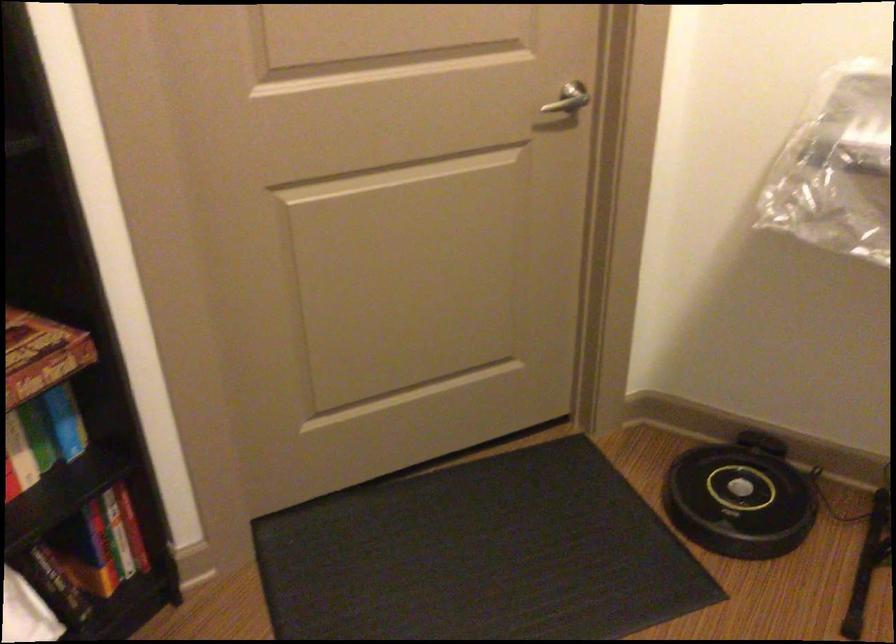
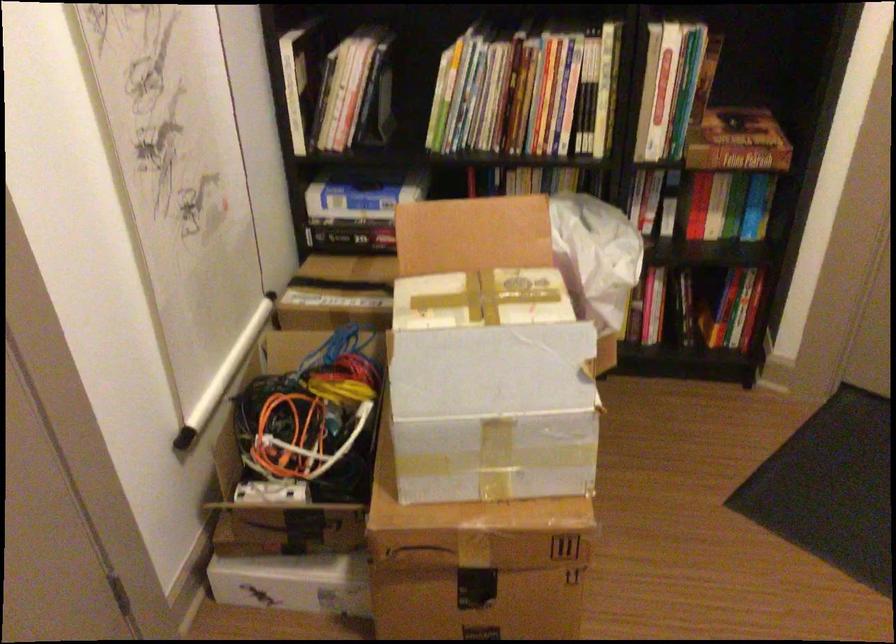
The point at (80, 565) is marked in the first image. Where is the corresponding point in the second image?

(695, 307)